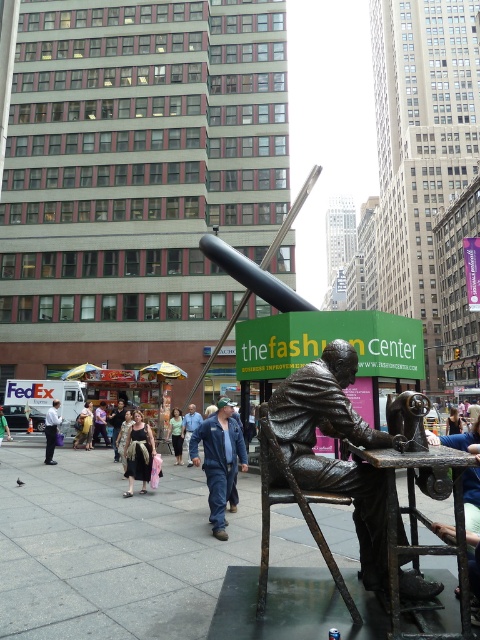
Consider the image. You are standing in the city center looking at the statue of the seated figure at the sewing machine. There are two points marked on the statue, one at coordinate point [240,452] and the other at point [51,419]. Which point is closer to your view?

Point [240,452] is closer to the camera than point [51,419].

You are a customer at the fashion center and see the dark blue jeans at center and the denim jacket at center. Which item is placed lower in the image?

The dark blue jeans at center is positioned under the denim jacket at center, so it is placed lower in the image.